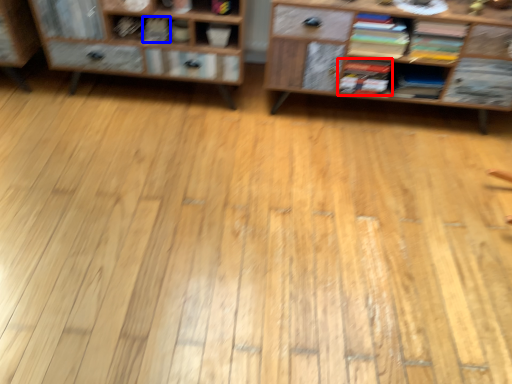
Question: Among these objects, which one is farthest to the camera, book (highlighted by a red box) or book (highlighted by a blue box)?

Choices:
 (A) book
 (B) book

Answer: (B)